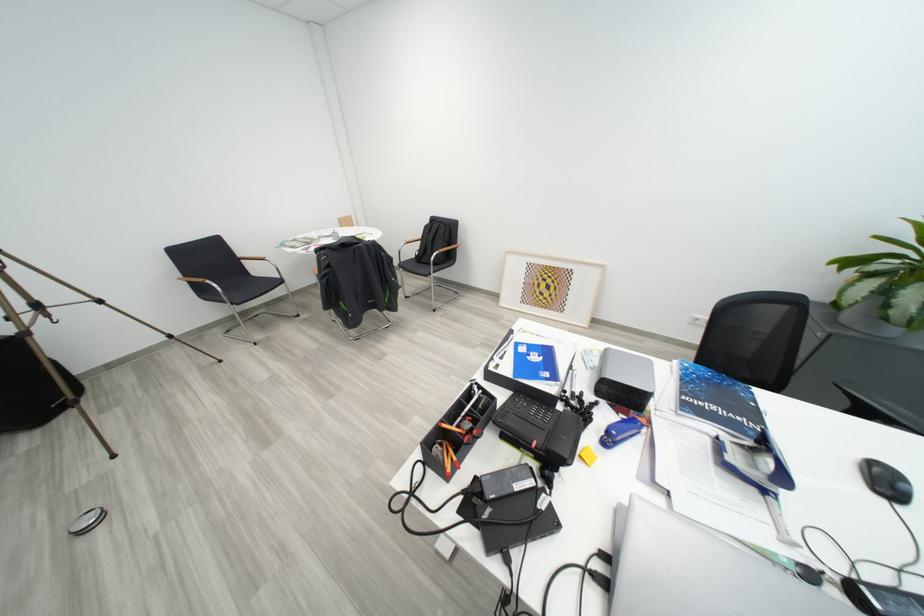
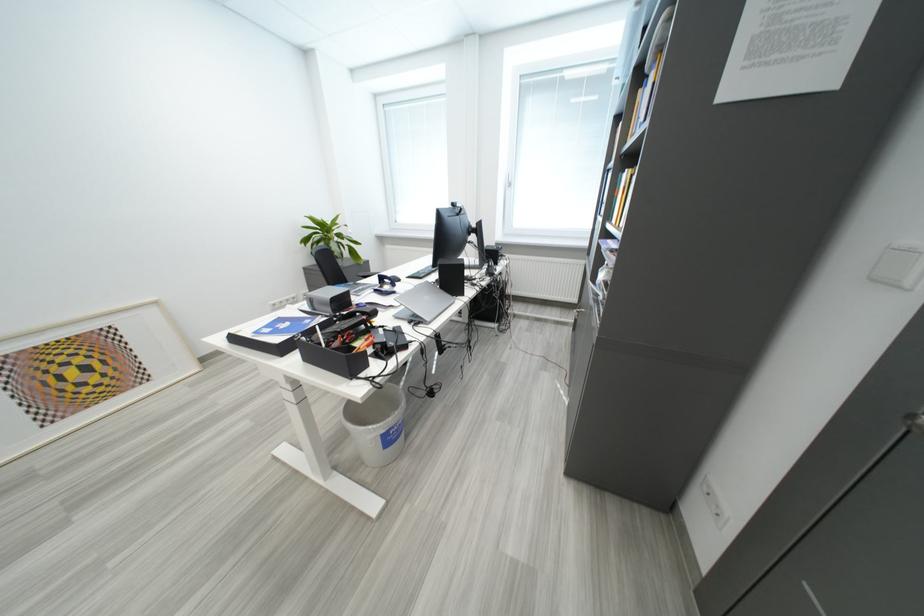
In the second image, find the point that corresponds to [555,377] in the first image.

(317, 323)